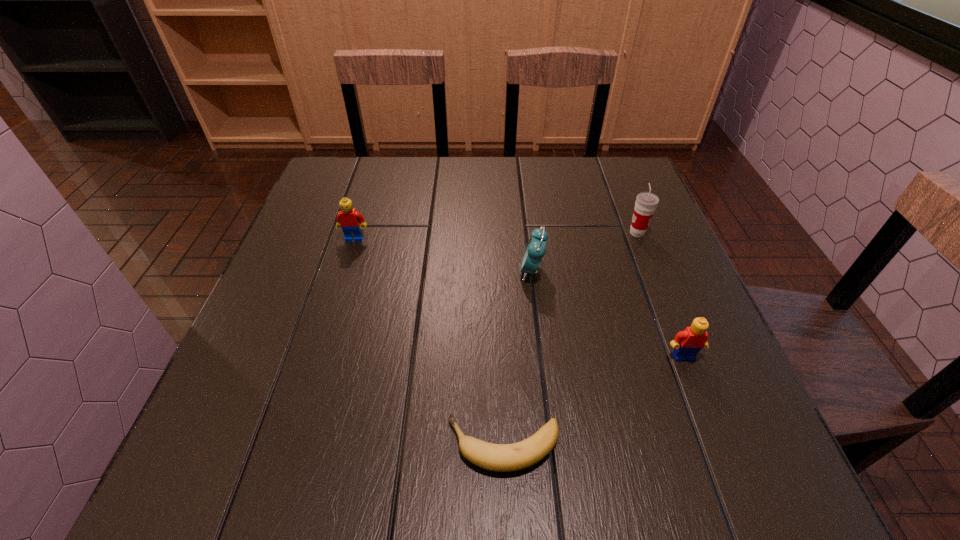
The image size is (960, 540). I want to click on object that is the second closest to the tallest object, so click(x=686, y=344).

The width and height of the screenshot is (960, 540). I want to click on vacant space that satisfies the following two spatial constraints: 1. on the face of the fourth farthest object; 2. at the stem of the shortest object, so click(718, 445).

What are the coordinates of `free space that satisfies the following two spatial constraints: 1. on the side of the cup with the logo; 2. on the face of the leftmost object` in the screenshot? It's located at (639, 238).